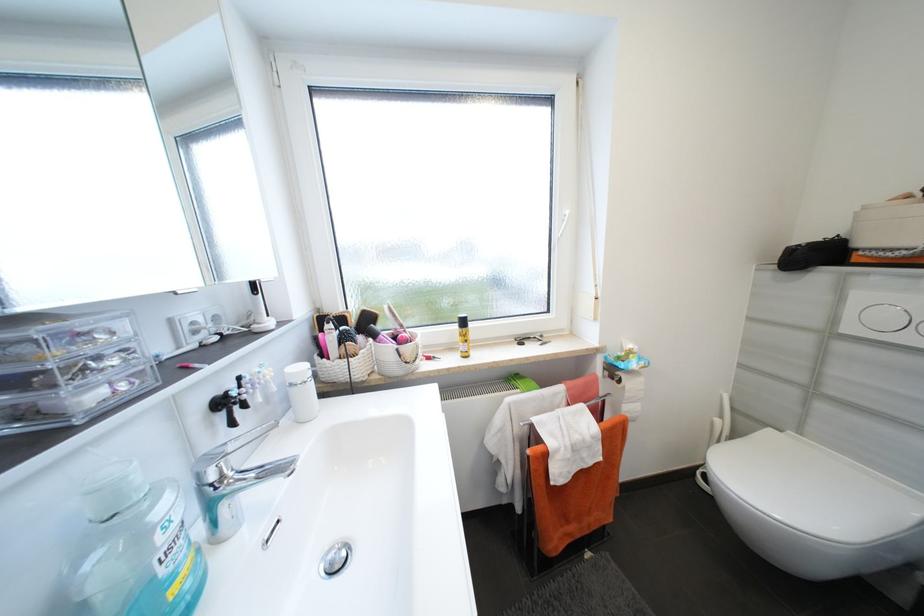
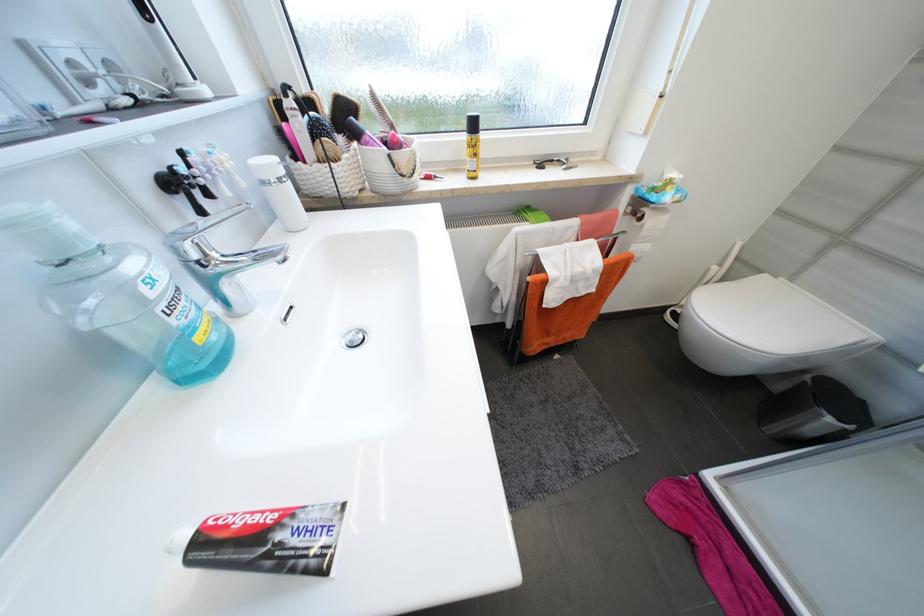
The point at (324, 310) is marked in the first image. Where is the corresponding point in the second image?

(280, 92)